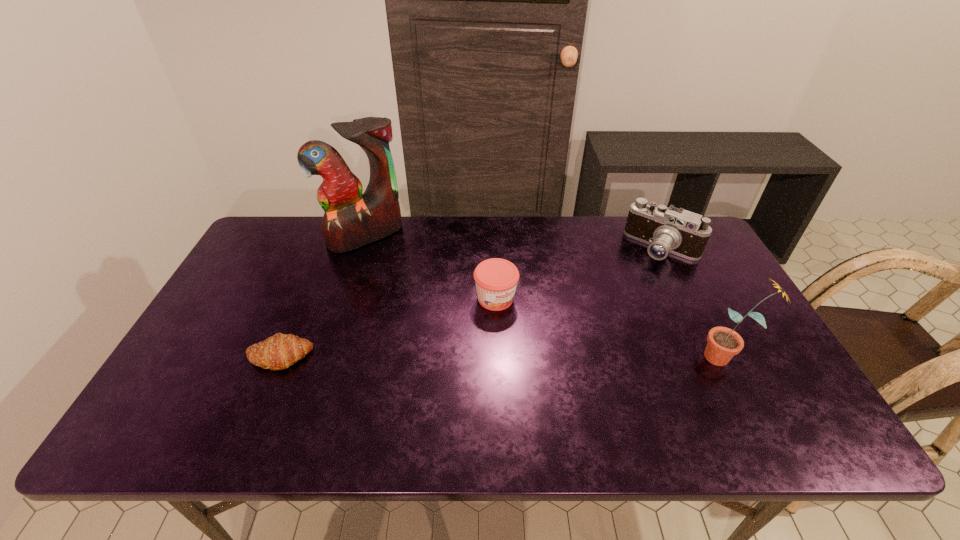
Where is `vacant space on the desktop that is between the crescent roll and the sunflower and is positioned at the face of the tallest object`? vacant space on the desktop that is between the crescent roll and the sunflower and is positioned at the face of the tallest object is located at coordinates (458, 356).

Where is `vacant space on the desktop that is between the crescent roll and the second tallest object and is positioned at the lens of the camera`? Image resolution: width=960 pixels, height=540 pixels. vacant space on the desktop that is between the crescent roll and the second tallest object and is positioned at the lens of the camera is located at coordinates (543, 356).

Identify the location of free spot on the desktop that is between the crescent roll and the second tallest object and is positioned on the front label of the fourth tallest object. The height and width of the screenshot is (540, 960). (546, 356).